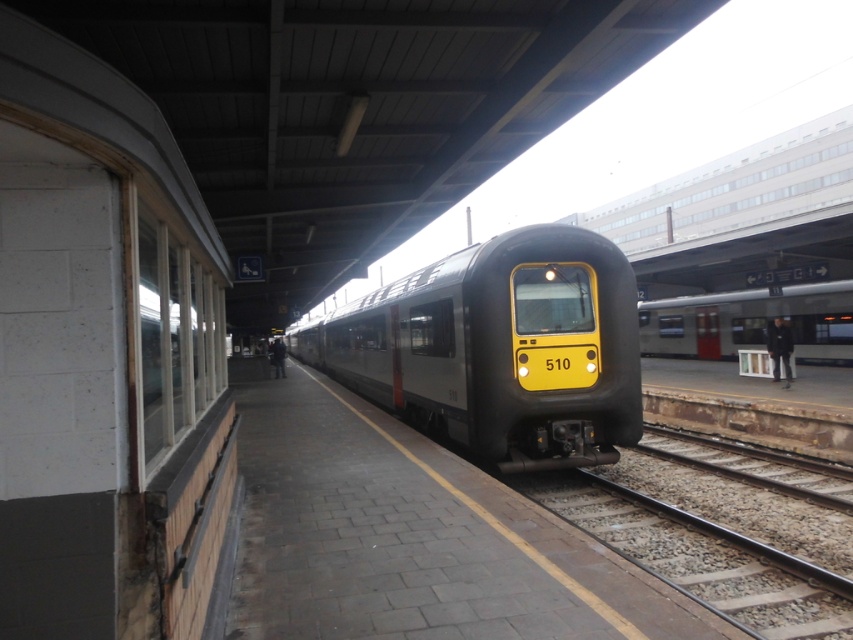
Is matte black train at center shorter than metallic silver train at center?

Incorrect, matte black train at center's height does not fall short of metallic silver train at center's.

Consider the image. Does matte black train at center have a smaller size compared to metallic silver train at center?

Yes, matte black train at center is smaller than metallic silver train at center.

The height and width of the screenshot is (640, 853). Identify the location of matte black train at center. (500, 348).

In the scene shown: Does smooth steel train track at center have a smaller size compared to metallic silver train at center?

Yes.

Between point (773, 637) and point (730, 349), which one is positioned in front?

Point (773, 637) is more forward.

Image resolution: width=853 pixels, height=640 pixels. Find the location of `smooth steel train track at center`. smooth steel train track at center is located at coordinates (717, 540).

Does point (468, 369) lie in front of point (694, 454)?

Yes, point (468, 369) is closer to viewer.

What do you see at coordinates (500, 348) in the screenshot?
I see `matte black train at center` at bounding box center [500, 348].

Which is in front, point (534, 291) or point (828, 545)?

Point (828, 545) is in front.

Where is `matte black train at center`? matte black train at center is located at coordinates (500, 348).